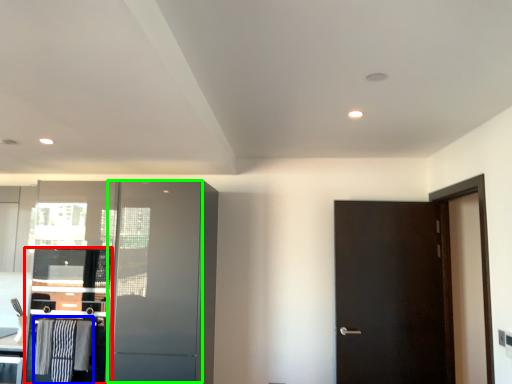
Question: Estimate the real-world distances between objects in this image. Which object is closer to cabinetry (highlighted by a red box), laundry (highlighted by a blue box) or screen door (highlighted by a green box)?

Choices:
 (A) laundry
 (B) screen door

Answer: (A)